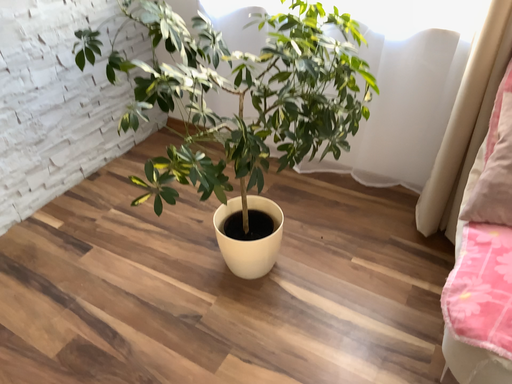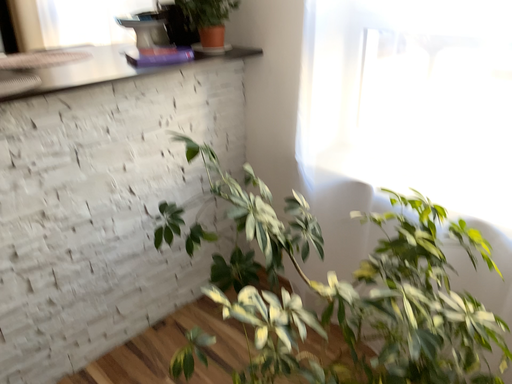
Question: Which way did the camera rotate in the video?

Choices:
 (A) rotated left
 (B) rotated right

Answer: (A)